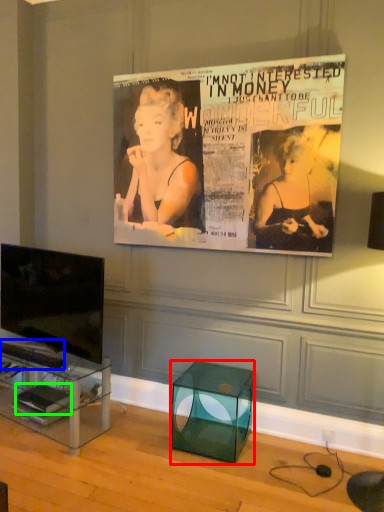
Question: Considering the real-world distances, which object is farthest from glass box (highlighted by a red box)? magazine (highlighted by a blue box) or magazine (highlighted by a green box)?

Choices:
 (A) magazine
 (B) magazine

Answer: (A)